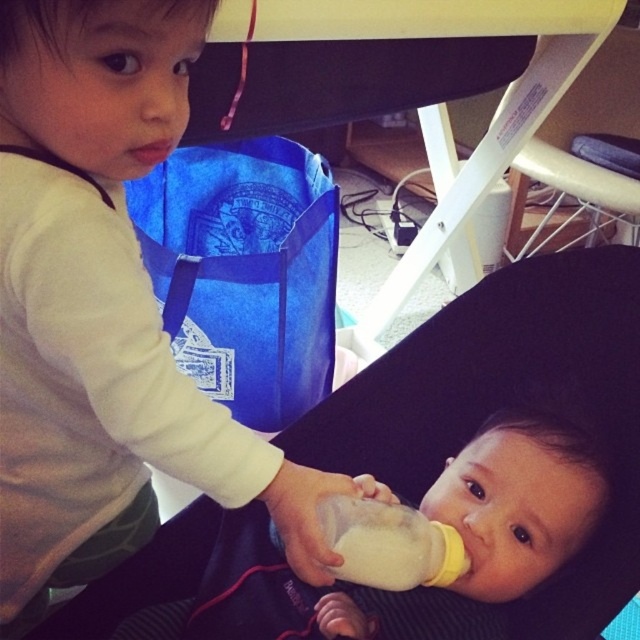
Looking at this image, how far apart are white matte baby bottle at lower center and smooth plastic bottle at center?

white matte baby bottle at lower center is 24.44 centimeters from smooth plastic bottle at center.

Between point (269, 497) and point (509, 490), which one is positioned behind?

The point (509, 490) is behind.

The image size is (640, 640). I want to click on white matte baby bottle at lower center, so click(106, 310).

Can you confirm if white matte baby bottle at lower center is positioned to the right of white matte bottle at center?

Incorrect, white matte baby bottle at lower center is not on the right side of white matte bottle at center.

Does white matte baby bottle at lower center have a larger size compared to white matte bottle at center?

Yes.

Does point (76, 252) lie in front of point (358, 525)?

That is True.

I want to click on white matte baby bottle at lower center, so click(x=106, y=310).

What do you see at coordinates (518, 499) in the screenshot? The image size is (640, 640). I see `smooth plastic bottle at center` at bounding box center [518, 499].

Who is more distant from viewer, (484, 480) or (394, 589)?

The point (484, 480) is more distant.

The width and height of the screenshot is (640, 640). What are the coordinates of `smooth plastic bottle at center` in the screenshot? It's located at (518, 499).